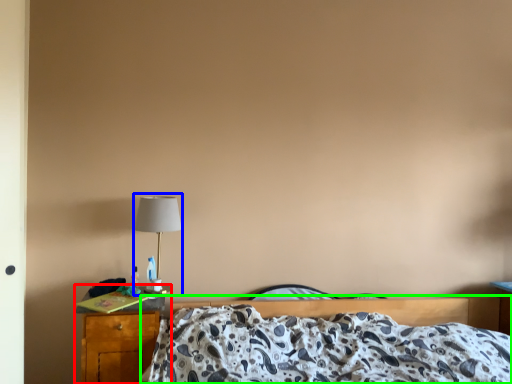
Question: Which is farther away from nightstand (highlighted by a red box)? table lamp (highlighted by a blue box) or bed (highlighted by a green box)?

Choices:
 (A) table lamp
 (B) bed

Answer: (B)